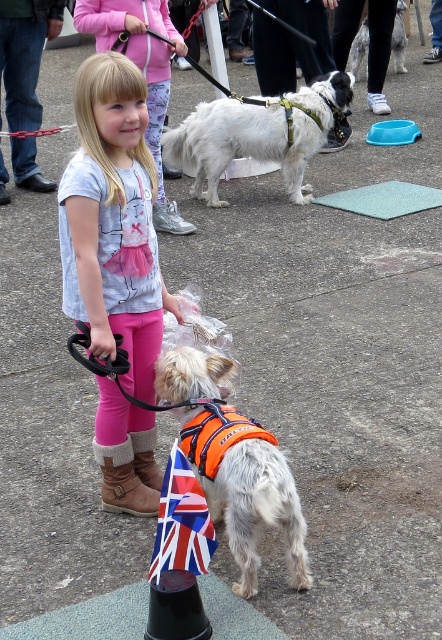
Consider the image. Is orange fabric dog at center bigger than white fur dog at center?

Incorrect, orange fabric dog at center is not larger than white fur dog at center.

Does point (242, 490) come in front of point (400, 36)?

Yes, it is.

You are a GUI agent. You are given a task and a screenshot of the screen. Output one action in this format:
    pyautogui.click(x=<x>, y=<y>)
    Task: Click on the orange fabric dog at center
    This screenshot has width=442, height=640.
    Given the screenshot: What is the action you would take?
    pyautogui.click(x=256, y=508)

Does matte pink leggings at center have a larger size compared to orange fabric dog at center?

Yes, matte pink leggings at center is bigger than orange fabric dog at center.

From the picture: Who is shorter, matte pink leggings at center or orange fabric dog at center?

orange fabric dog at center is shorter.

Does point (124, 476) come farther from viewer compared to point (237, 460)?

That is True.

At what (x,y) coordinates should I click in order to perform the action: click on matte pink leggings at center. Please return your answer as a coordinate pair (x, y). Looking at the image, I should click on (114, 220).

Can you confirm if matte pink leggings at center is positioned below white fur dog at center?

Correct, matte pink leggings at center is located below white fur dog at center.

Describe the element at coordinates (114, 220) in the screenshot. I see `matte pink leggings at center` at that location.

This screenshot has height=640, width=442. What are the coordinates of `matte pink leggings at center` in the screenshot? It's located at (114, 220).